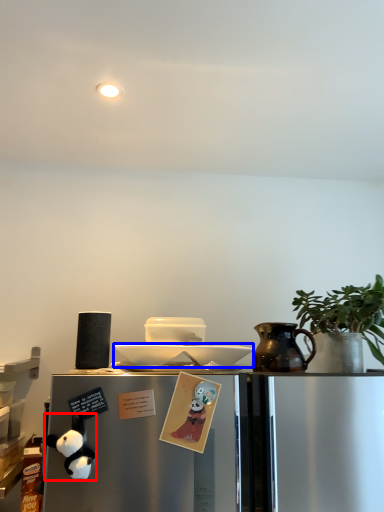
Question: Among these objects, which one is farthest to the camera, toy (highlighted by a red box) or plate (highlighted by a blue box)?

Choices:
 (A) toy
 (B) plate

Answer: (B)